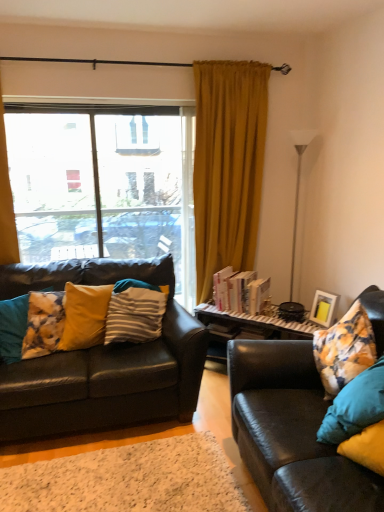
Question: Considering the positions of mustard yellow velvet curtain at center, the second curtain from the left, and white textured rug at lower center in the image, is mustard yellow velvet curtain at center, the second curtain from the left, wider or thinner than white textured rug at lower center?

Choices:
 (A) thin
 (B) wide

Answer: (A)

Question: In the image, is mustard yellow velvet curtain at center, positioned as the first curtain in right-to-left order, positioned in front of or behind white textured rug at lower center?

Choices:
 (A) behind
 (B) front

Answer: (A)

Question: Considering the real-world distances, which object is farthest from the matte black couch at right, the 2th studio couch when ordered from left to right?

Choices:
 (A) yellow striped pillow at left, arranged as the first pillow when viewed from the right
 (B) leather couch at left, the 2th studio couch from the right
 (C) matte yellow picture frame at right
 (D) white glossy floor lamp at right
 (E) hardcover books at center

Answer: (D)

Question: Estimate the real-world distances between objects in this image. Which object is farther from the mustard yellow fabric curtain at left, arranged as the 1th curtain when viewed from the left?

Choices:
 (A) hardcover books at center
 (B) white glossy floor lamp at right
 (C) leather couch at left, the 2th studio couch from the right
 (D) white textured rug at lower center
 (E) mustard yellow velvet curtain at center, positioned as the first curtain in right-to-left order

Answer: (B)